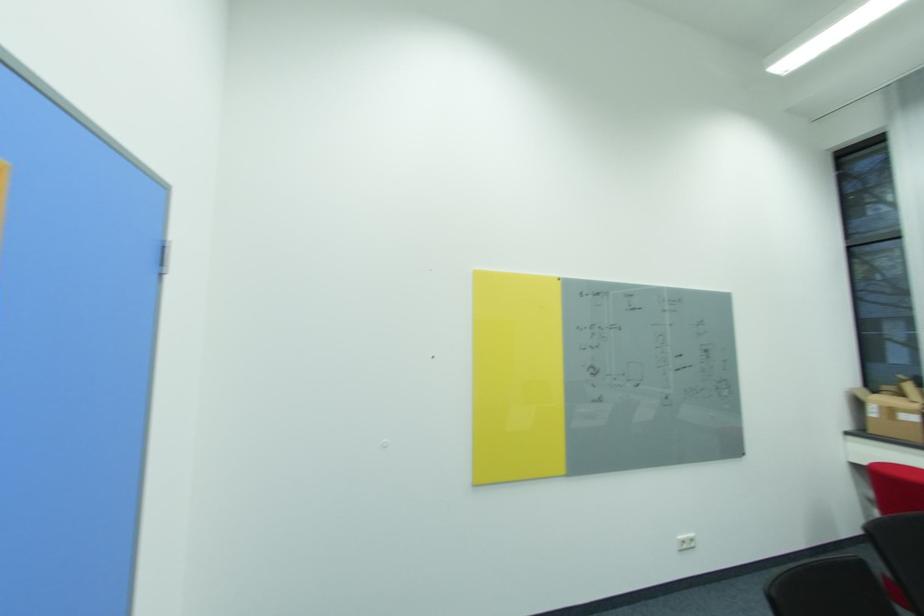
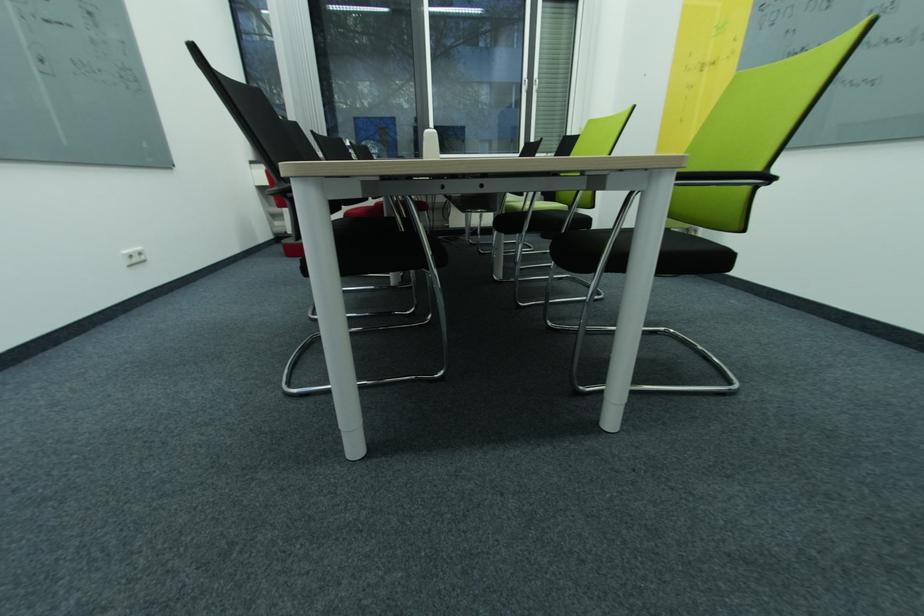
The images are taken continuously from a first-person perspective. In which direction is your viewpoint rotating?

The camera rotated toward right-down.